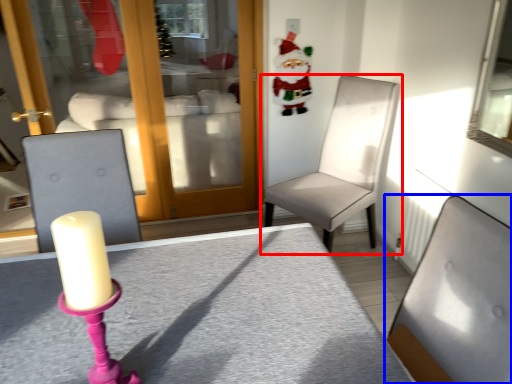
Question: Which object appears farthest to the camera in this image, chair (highlighted by a red box) or chair (highlighted by a blue box)?

Choices:
 (A) chair
 (B) chair

Answer: (A)